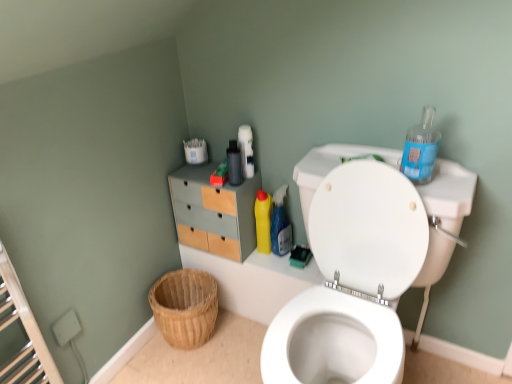
Find the location of a particular element. free space in front of yellow plastic bottle at center, which is the first cleaning product in back-to-front order is located at coordinates [x=277, y=266].